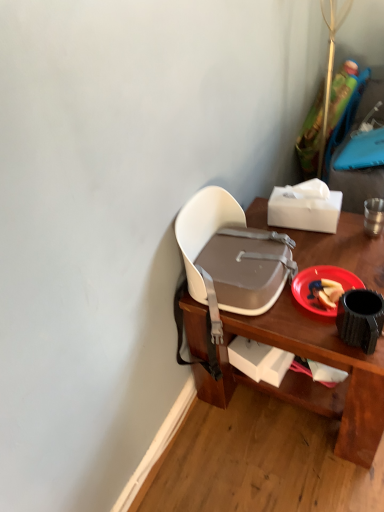
At what (x,y) coordinates should I click in order to perform the action: click on vacant space situated above white plastic chair at upper center (from a real-world perspective). Please return your answer as a coordinate pair (x, y). The width and height of the screenshot is (384, 512). Looking at the image, I should click on (324, 263).